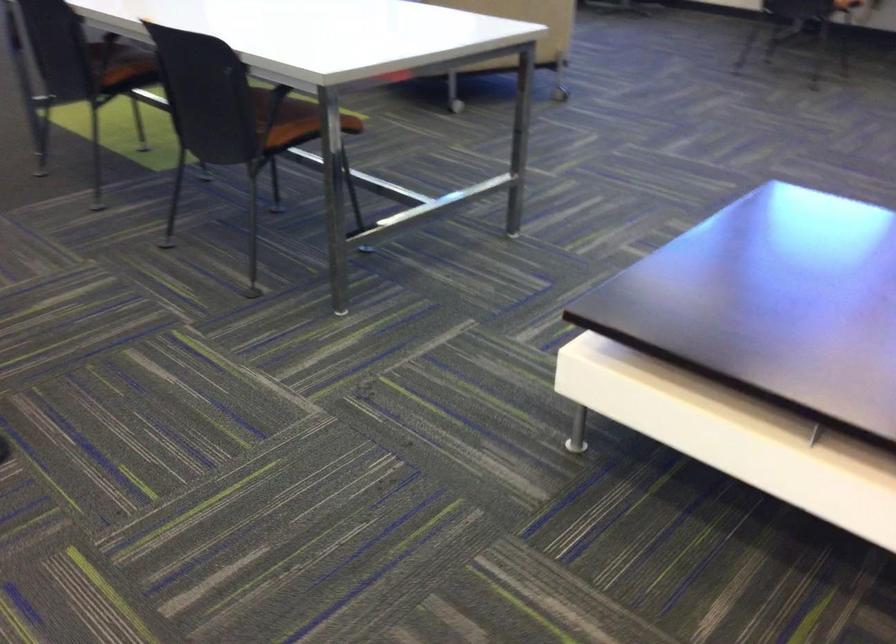
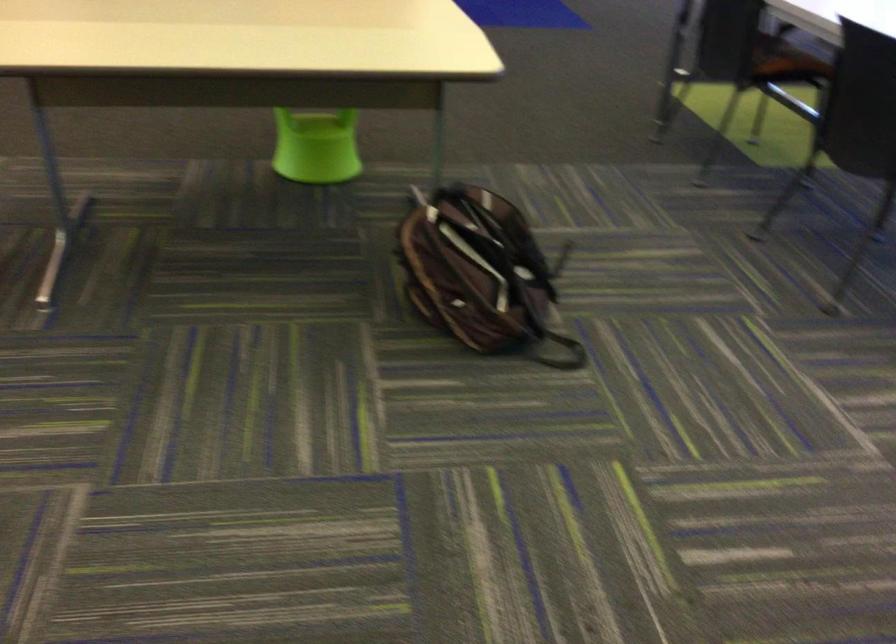
Question: The images are taken continuously from a first-person perspective. In which direction is your viewpoint rotating?

Choices:
 (A) Left
 (B) Right
 (C) Up
 (D) Down

Answer: (A)